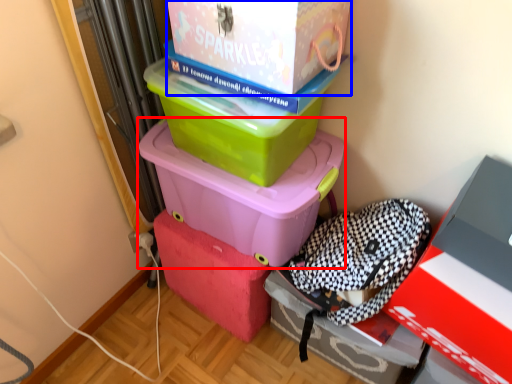
Question: Among these objects, which one is farthest to the camera, box (highlighted by a red box) or box (highlighted by a blue box)?

Choices:
 (A) box
 (B) box

Answer: (A)